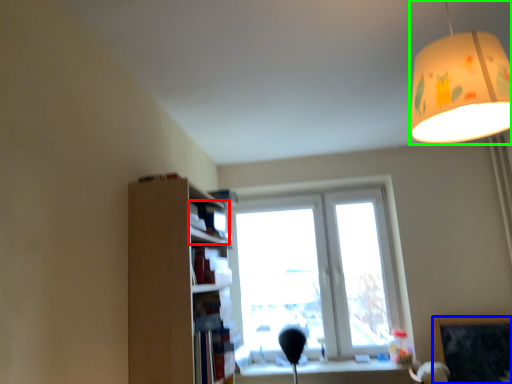
Question: Which object is the farthest from book (highlighted by a red box)? Choose among these: bulletin board (highlighted by a blue box) or lamp (highlighted by a green box).

Choices:
 (A) bulletin board
 (B) lamp

Answer: (A)